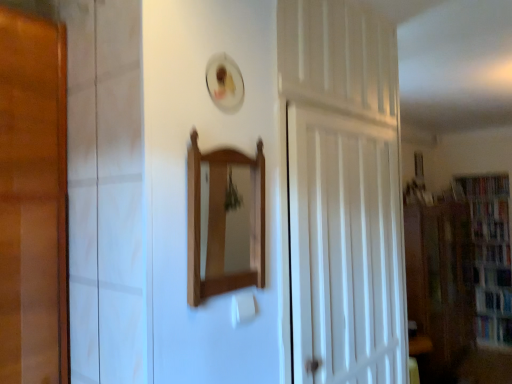
Question: Considering the relative sizes of hardcover book at right, the 4th book ordered from the bottom, and wooden bookcase at right in the image provided, is hardcover book at right, the 4th book ordered from the bottom, wider than wooden bookcase at right?

Choices:
 (A) no
 (B) yes

Answer: (B)

Question: Is hardcover book at right, the 4th book ordered from the bottom, positioned with its back to wooden bookcase at right?

Choices:
 (A) yes
 (B) no

Answer: (A)

Question: Does hardcover book at right, the 4th book ordered from the bottom, have a smaller size compared to wooden bookcase at right?

Choices:
 (A) no
 (B) yes

Answer: (B)

Question: From the image's perspective, is hardcover book at right, which is the 1th book from top to bottom, below wooden bookcase at right?

Choices:
 (A) yes
 (B) no

Answer: (B)

Question: Is hardcover book at right, the 4th book ordered from the bottom, with wooden bookcase at right?

Choices:
 (A) no
 (B) yes

Answer: (A)

Question: Does point (483, 243) appear closer or farther from the camera than point (315, 316)?

Choices:
 (A) farther
 (B) closer

Answer: (A)

Question: In terms of width, does hardcover book at right, marked as the second book in a top-to-bottom arrangement, look wider or thinner when compared to white wooden door at center?

Choices:
 (A) thin
 (B) wide

Answer: (B)

Question: Looking at the image, does hardcover book at right, marked as the second book in a top-to-bottom arrangement, seem bigger or smaller compared to white wooden door at center?

Choices:
 (A) small
 (B) big

Answer: (A)

Question: Is hardcover book at right, marked as the second book in a top-to-bottom arrangement, situated inside white wooden door at center or outside?

Choices:
 (A) outside
 (B) inside

Answer: (A)

Question: Relative to hardcover book at right, which is counted as the third book, starting from the bottom, is hardcover book at right, the 4th book ordered from the bottom, in front or behind?

Choices:
 (A) behind
 (B) front

Answer: (B)

Question: In terms of size, does hardcover book at right, which is the 1th book from top to bottom, appear bigger or smaller than hardcover book at right, marked as the second book in a top-to-bottom arrangement?

Choices:
 (A) small
 (B) big

Answer: (B)

Question: Considering the relative positions of hardcover book at right, which is the 1th book from top to bottom, and hardcover book at right, which is counted as the third book, starting from the bottom, in the image provided, is hardcover book at right, which is the 1th book from top to bottom, to the left or to the right of hardcover book at right, which is counted as the third book, starting from the bottom,?

Choices:
 (A) left
 (B) right

Answer: (A)

Question: Would you say hardcover book at right, the 4th book ordered from the bottom, is inside or outside hardcover book at right, marked as the second book in a top-to-bottom arrangement?

Choices:
 (A) outside
 (B) inside

Answer: (A)

Question: From a real-world perspective, relative to hardcover book at right, the 3th book from the top, is hardcover book at right, marked as the second book in a top-to-bottom arrangement, vertically above or below?

Choices:
 (A) below
 (B) above

Answer: (B)

Question: Visually, is hardcover book at right, marked as the second book in a top-to-bottom arrangement, positioned to the left or to the right of hardcover book at right, acting as the second book starting from the bottom?

Choices:
 (A) left
 (B) right

Answer: (B)